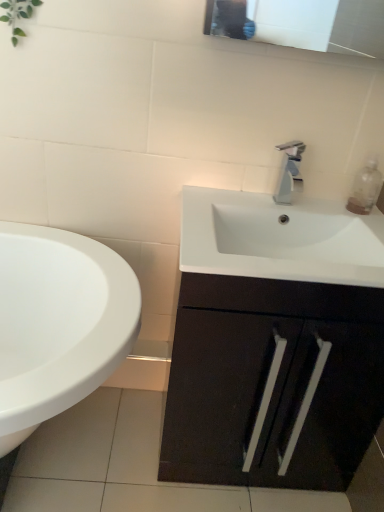
The height and width of the screenshot is (512, 384). Find the location of `vacant area located to the right-hand side of silver metallic faucet at center`. vacant area located to the right-hand side of silver metallic faucet at center is located at coordinates (329, 211).